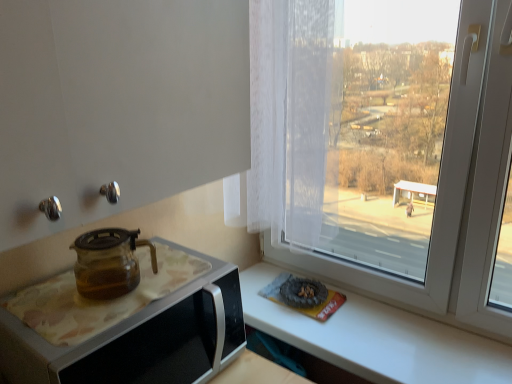
You are a GUI agent. You are given a task and a screenshot of the screen. Output one action in this format:
    pyautogui.click(x=<x>, y=<y>)
    Task: Click on the vacant area located to the right-hand side of transparent glass teapot at left
    The width and height of the screenshot is (512, 384).
    Given the screenshot: What is the action you would take?
    pyautogui.click(x=181, y=292)